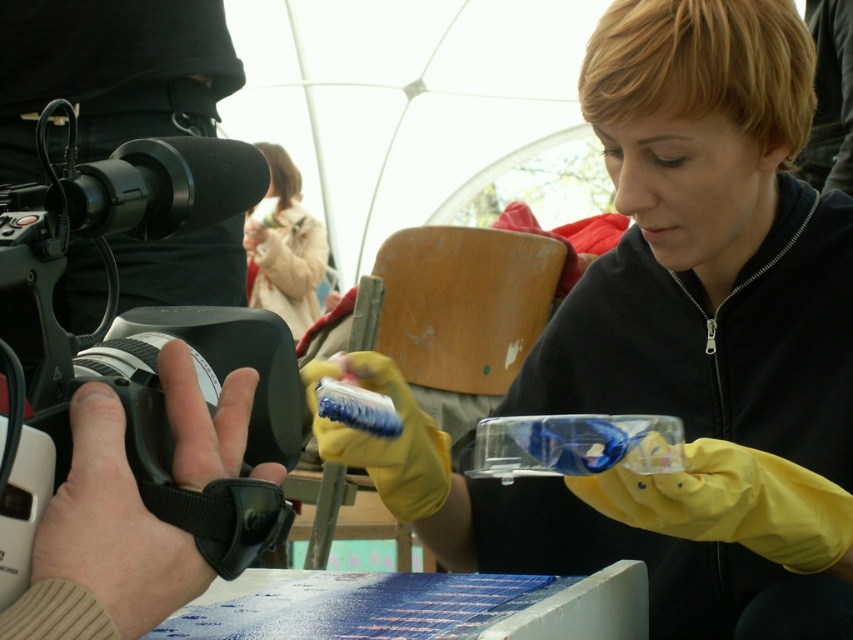
You are setting up equipment for a video shoot. You have a black plastic video camera at left and a fuzzy beige coat at upper left. Which object should you place closer to the edge of the table to ensure stability?

The black plastic video camera at left is smaller than the fuzzy beige coat at upper left, so placing the smaller object closer to the edge might be more stable as it requires less space.

You are analyzing the positions of two points in the image. The first point is at coordinates point (x=229, y=161) and the second is at point (x=276, y=186). Which point is nearer to the camera?

Point (x=229, y=161) is closer to the camera than point (x=276, y=186).

You are setting up a science experiment and need to place the yellow rubber gloves at center and the black plastic video camera at left on a shelf. The shelf has a width of 1 meter. If the gloves are wider than the camera, can both items fit side by side on the shelf without overlapping?

The yellow rubber gloves at center are wider than the black plastic video camera at left. However, since the shelf is 1 meter wide and the combined width of both items is not specified, it is possible they could fit if their total width does not exceed 1 meter. Without exact measurements, we cannot confirm for certain.